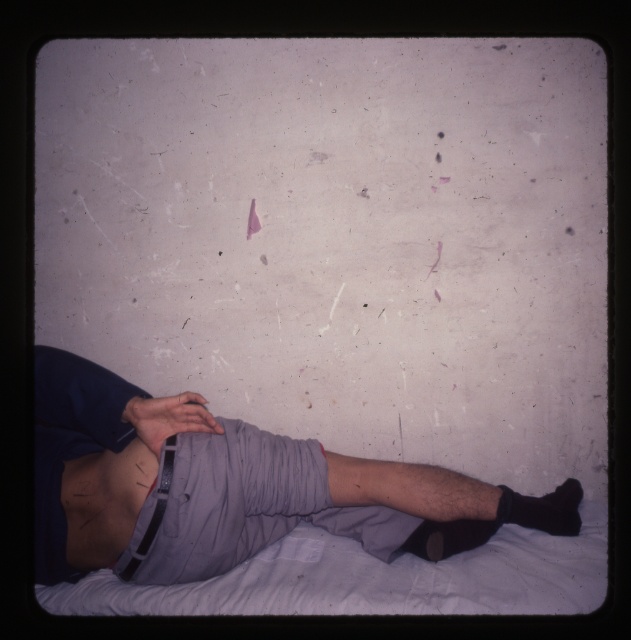
Based on the photo, you are a photographer setting up a shoot in this scene. You need to place a small prop between the gray cotton shorts at center and the black matte sock at lower right. Which object should the prop be closer to if it needs to be near the larger item?

The gray cotton shorts at center is bigger than the black matte sock at lower right, so the prop should be placed closer to the gray cotton shorts at center.

You are a photographer trying to capture the texture of the wall in the image. You notice a specific point labeled as point (105,500). Based on the scene description, what surface feature is located at this coordinate?

The point (105,500) corresponds to smooth skin at lower center.

You are a photographer setting up a shoot in this scene. You need to place a small prop between the smooth skin at lower center and the black matte sock at lower right. Based on their positions, where should the prop be placed relative to these two objects?

The prop should be placed between the smooth skin at lower center and the black matte sock at lower right, as the smooth skin at lower center is in front of the black matte sock at lower right.